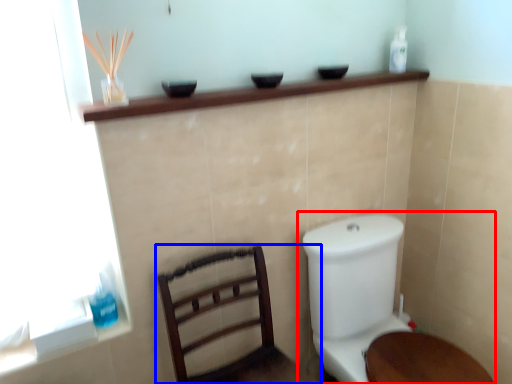
Question: Which point is further to the camera, toilet (highlighted by a red box) or furniture (highlighted by a blue box)?

Choices:
 (A) toilet
 (B) furniture

Answer: (A)